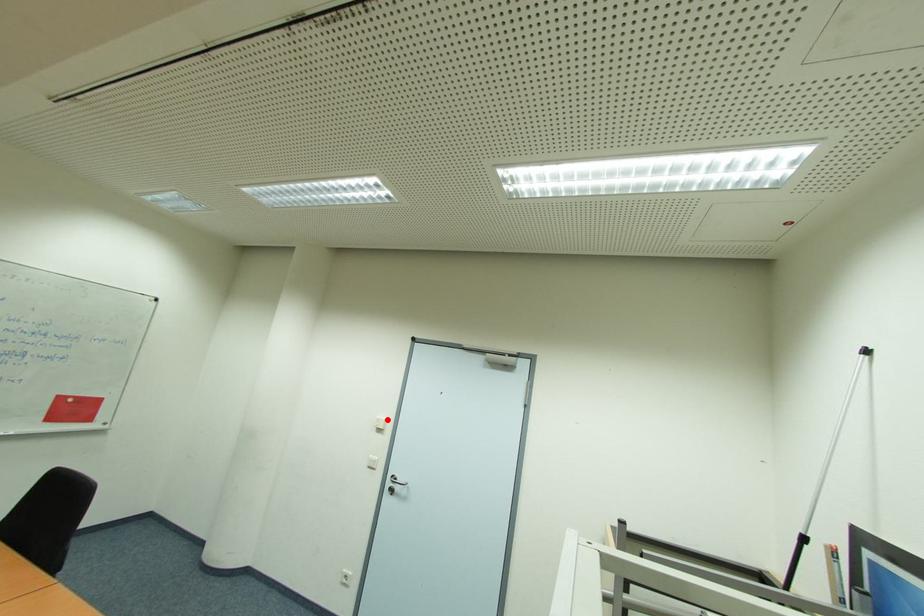
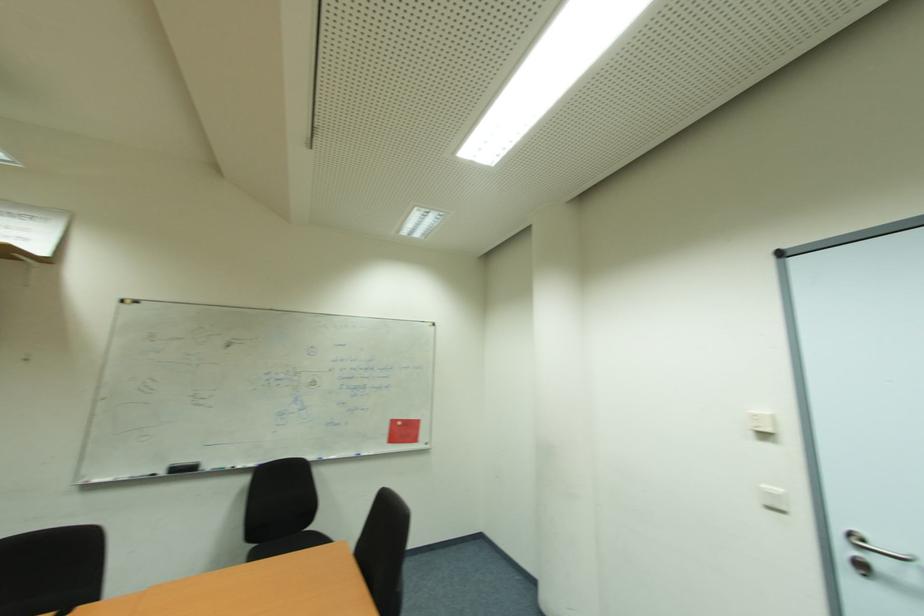
Where in the second image is the point corresponding to the highlighted location from the first image?

(771, 414)